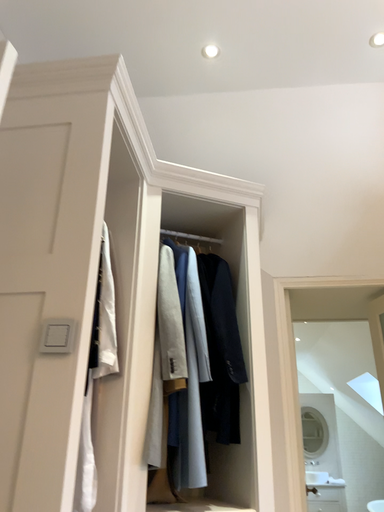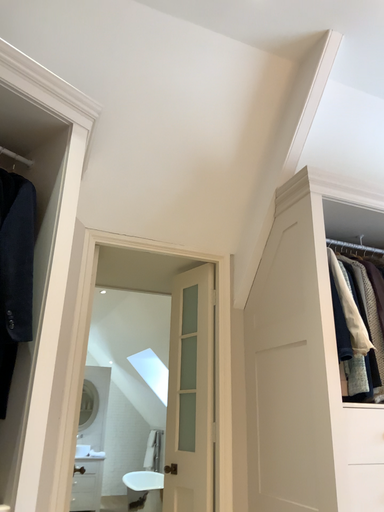
Question: Which way did the camera rotate in the video?

Choices:
 (A) rotated upward
 (B) rotated downward

Answer: (B)